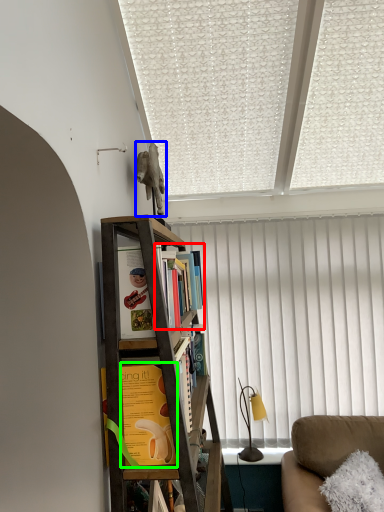
Question: Estimate the real-world distances between objects in this image. Which object is closer to book (highlighted by a red box), animal (highlighted by a blue box) or book (highlighted by a green box)?

Choices:
 (A) animal
 (B) book

Answer: (A)